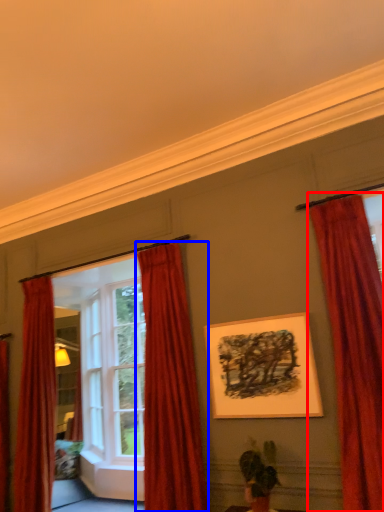
Question: Which point is further to the camera, curtain (highlighted by a red box) or curtain (highlighted by a blue box)?

Choices:
 (A) curtain
 (B) curtain

Answer: (B)